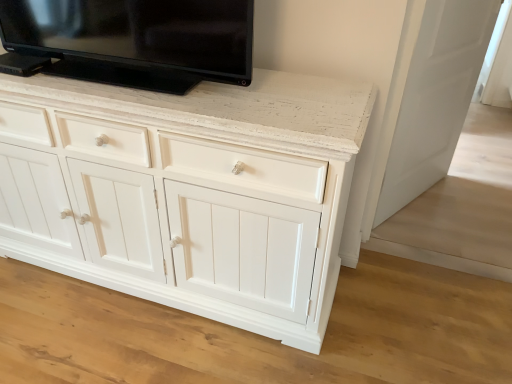
Locate an element on the screen. The height and width of the screenshot is (384, 512). vacant area that lies in front of white glossy door at right is located at coordinates (444, 230).